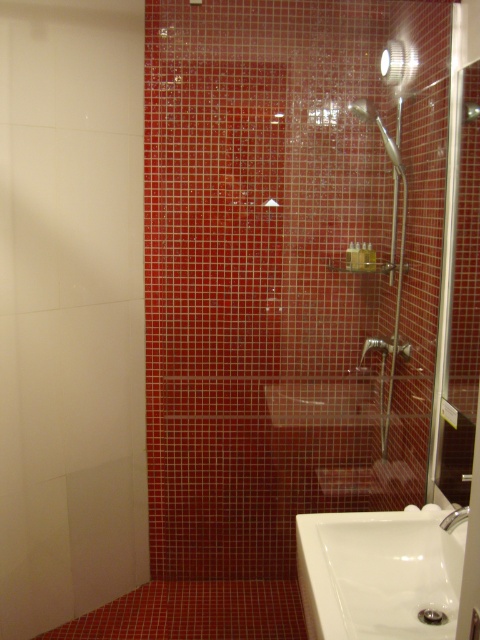
You are standing in the bathroom and need to reach the metallic silver shower head at upper center. Based on its coordinates, is it positioned closer to the top or the bottom of the shower area?

The metallic silver shower head at upper center is located at point 0.203 on the vertical axis, which places it closer to the bottom of the shower area since 0.203 is less than 0.5. However, its horizontal position at 0.790 suggests it is more towards the right side, but the question specifically asks about top or bottom. Therefore, it is closer to the bottom.

You are standing in the bathroom and want to turn on the faucet. Which object should you interact with first, the white glossy sink at lower right or the matte silver faucet at lower right?

To turn on the faucet, you should interact with the matte silver faucet at lower right first. The white glossy sink at lower right is in front of the matte silver faucet at lower right, so you need to reach around or behind the sink to access the faucet.